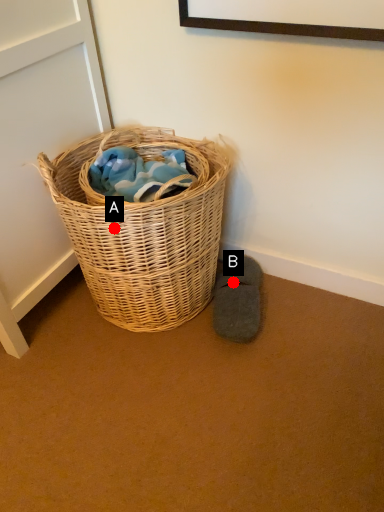
Question: Two points are circled on the image, labeled by A and B beside each circle. Which point is farther to the camera?

Choices:
 (A) A is further
 (B) B is further

Answer: (B)